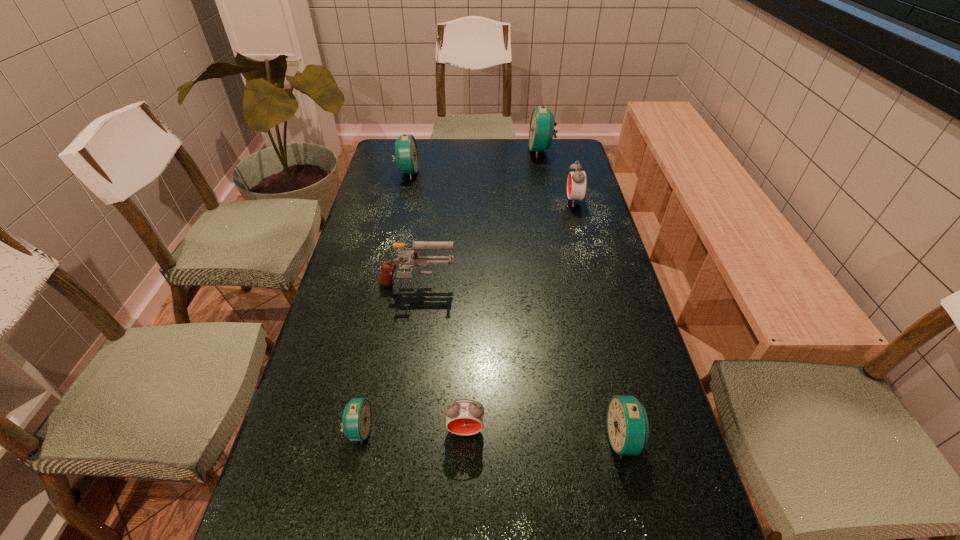
Find the location of a particular element. This screenshot has height=540, width=960. object that is the fourth nearest to the right red alarm clock is located at coordinates (627, 422).

I want to click on alarm clock identified as the second closest to the farthest object, so click(406, 155).

Select which alarm clock appears as the closest to the smaller red alarm clock. Please provide its 2D coordinates. Your answer should be formatted as a tuple, i.e. [(x, y)], where the tuple contains the x and y coordinates of a point satisfying the conditions above.

[(356, 419)]

Identify which blue alarm clock is the second nearest to the right red alarm clock. Please provide its 2D coordinates. Your answer should be formatted as a tuple, i.e. [(x, y)], where the tuple contains the x and y coordinates of a point satisfying the conditions above.

[(406, 155)]

This screenshot has height=540, width=960. I want to click on blue alarm clock identified as the second closest to the second farthest object, so click(x=356, y=419).